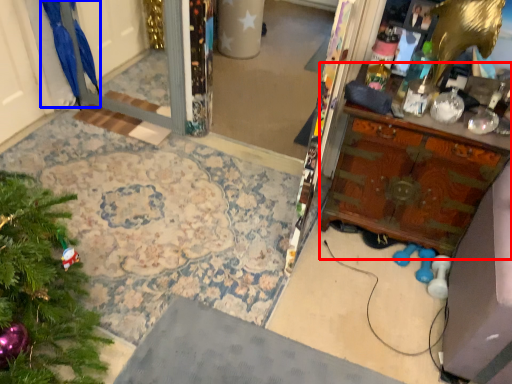
Question: Which object is further to the camera taking this photo, vanity (highlighted by a red box) or parrot (highlighted by a blue box)?

Choices:
 (A) vanity
 (B) parrot

Answer: (B)